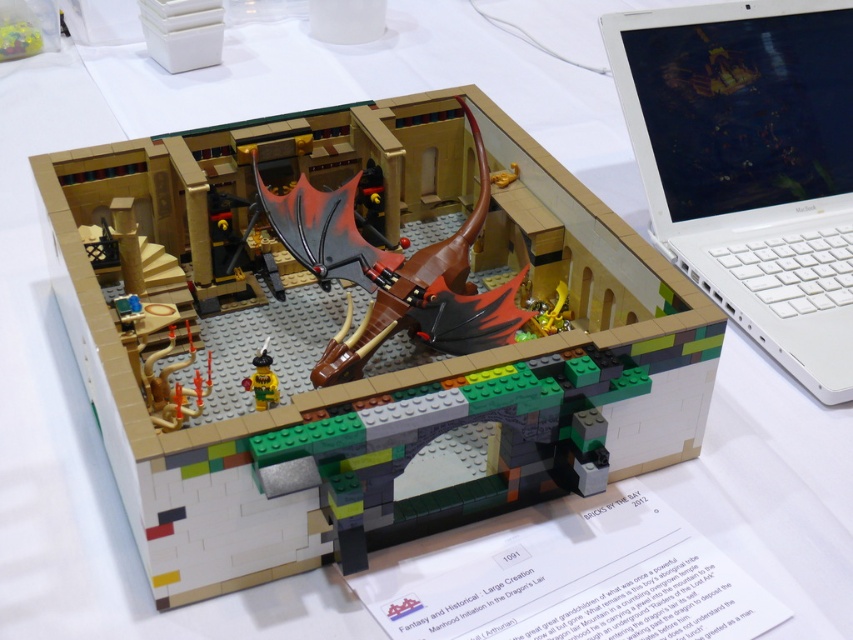
You are an architect reviewing a LEGO model. You notice the white plastic laptop at upper right and the shiny metallic dragon at center. Which object is positioned higher in the image?

The white plastic laptop at upper right is positioned above the shiny metallic dragon at center, so it is higher in the image.

You are an architect examining a LEGO model. You notice the white plastic laptop at upper right and the shiny metallic dragon at center. Which object is located to the right of the other?

The white plastic laptop at upper right is positioned on the right side of the shiny metallic dragon at center.